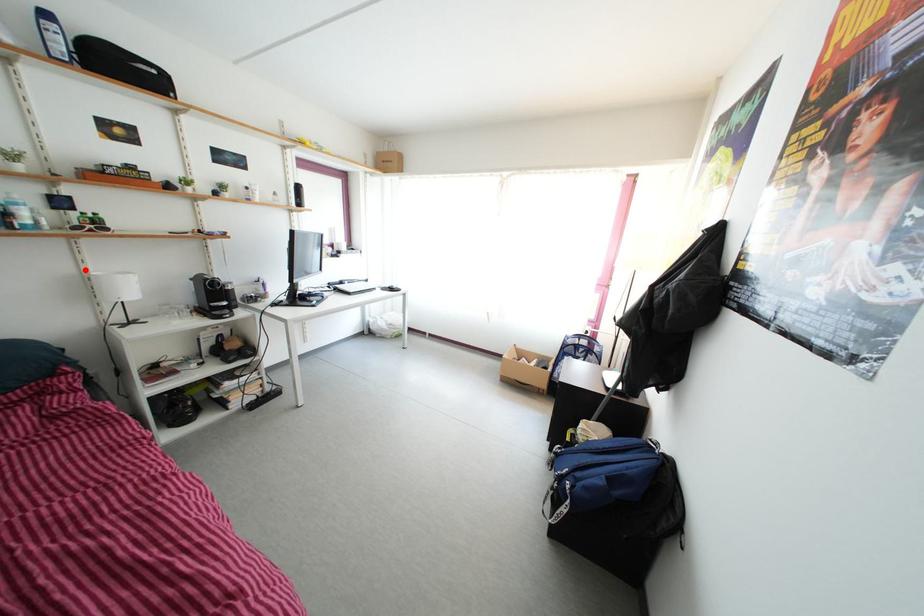
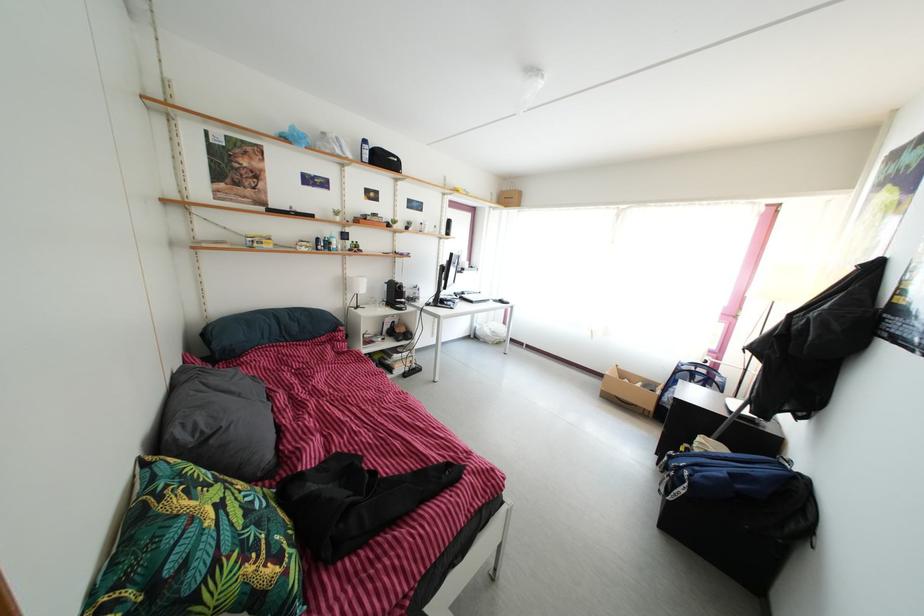
Question: A red point is marked in image1. In image2, is the corresponding 3D point closer to the camera or farther? Reply with the corresponding letter.

Choices:
 (A) The corresponding 3D point is closer.
 (B) The corresponding 3D point is farther.

Answer: (A)